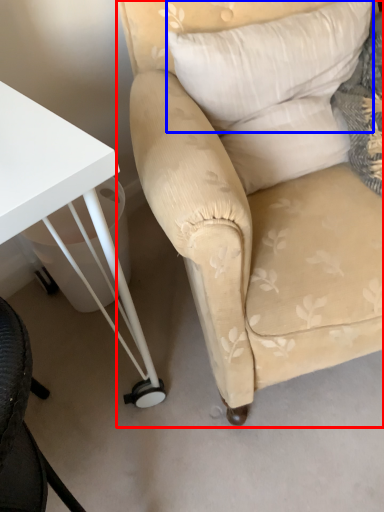
Question: Which of the following is the farthest to the observer, chair (highlighted by a red box) or pillow (highlighted by a blue box)?

Choices:
 (A) chair
 (B) pillow

Answer: (B)